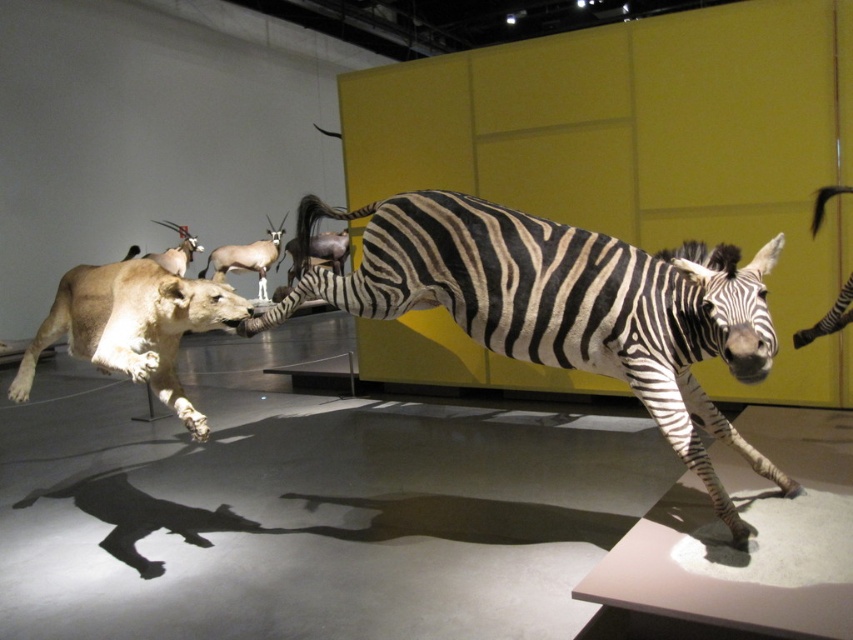
Question: Which object is the farthest from the light brown fur lioness at left?

Choices:
 (A) black and white striped zebra at center
 (B) brown glossy antelope at center
 (C) brown glossy antelope at upper left

Answer: (C)

Question: Which object is farther from the camera taking this photo?

Choices:
 (A) brown glossy antelope at upper left
 (B) light brown fur lioness at left
 (C) black and white striped zebra at center

Answer: (A)

Question: Is light brown fur lioness at left below brown glossy antelope at center?

Choices:
 (A) no
 (B) yes

Answer: (B)

Question: Is black and white striped zebra at center wider than brown glossy antelope at upper left?

Choices:
 (A) no
 (B) yes

Answer: (B)

Question: Which of these objects is positioned closest to the brown glossy antelope at upper left?

Choices:
 (A) black and white striped zebra at center
 (B) brown glossy antelope at center
 (C) light brown fur lioness at left

Answer: (B)

Question: Does brown glossy antelope at center come behind brown glossy antelope at upper left?

Choices:
 (A) yes
 (B) no

Answer: (B)